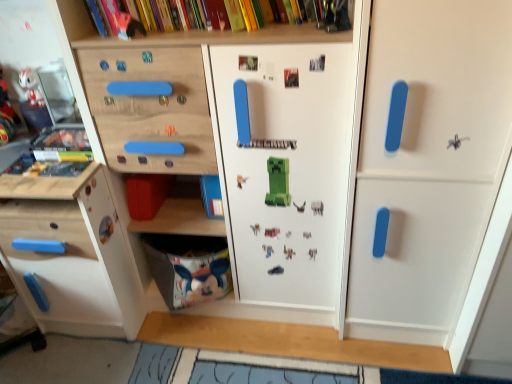
Question: Is white matte door at right with matte plastic rabbit at upper left?

Choices:
 (A) no
 (B) yes

Answer: (A)

Question: From the image's perspective, is white matte door at right on top of matte plastic rabbit at upper left?

Choices:
 (A) yes
 (B) no

Answer: (B)

Question: Can you confirm if white matte door at right is bigger than matte plastic rabbit at upper left?

Choices:
 (A) no
 (B) yes

Answer: (B)

Question: Does white matte door at right turn towards matte plastic rabbit at upper left?

Choices:
 (A) yes
 (B) no

Answer: (B)

Question: Is the position of white matte door at right less distant than that of matte plastic rabbit at upper left?

Choices:
 (A) no
 (B) yes

Answer: (B)

Question: From the image's perspective, does white matte door at right appear lower than matte plastic rabbit at upper left?

Choices:
 (A) no
 (B) yes

Answer: (B)

Question: Is white matte door at right closer to the viewer compared to white fabric bag at lower center?

Choices:
 (A) no
 (B) yes

Answer: (B)

Question: Can you confirm if white matte door at right is wider than white fabric bag at lower center?

Choices:
 (A) no
 (B) yes

Answer: (B)

Question: From a real-world perspective, does white matte door at right sit lower than white fabric bag at lower center?

Choices:
 (A) yes
 (B) no

Answer: (B)

Question: Is white matte door at right to the right of white fabric bag at lower center from the viewer's perspective?

Choices:
 (A) no
 (B) yes

Answer: (B)

Question: From the image's perspective, does white matte door at right appear lower than white fabric bag at lower center?

Choices:
 (A) yes
 (B) no

Answer: (B)

Question: Is white matte door at right shorter than white fabric bag at lower center?

Choices:
 (A) no
 (B) yes

Answer: (A)

Question: Considering the relative sizes of matte plastic rabbit at upper left and white matte door at right in the image provided, is matte plastic rabbit at upper left taller than white matte door at right?

Choices:
 (A) yes
 (B) no

Answer: (B)